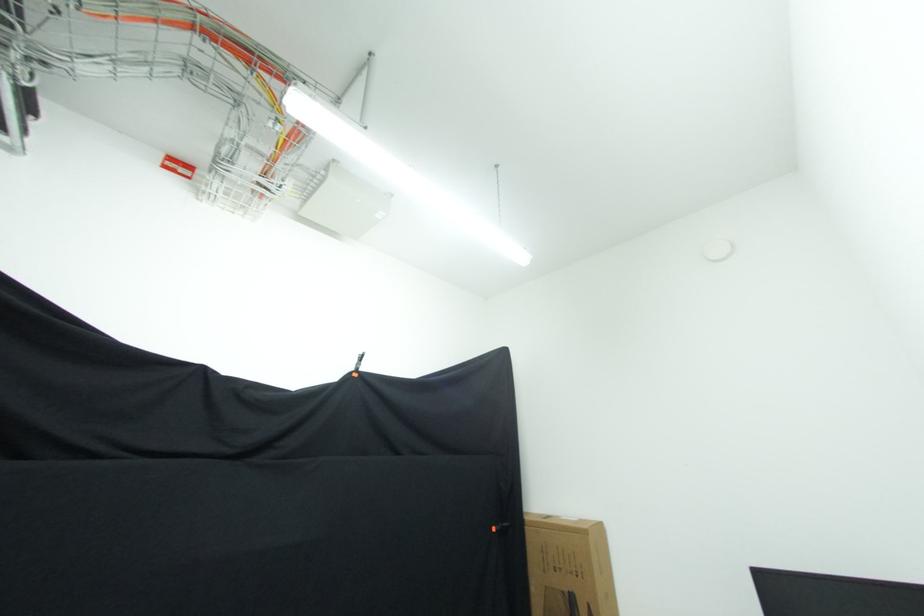
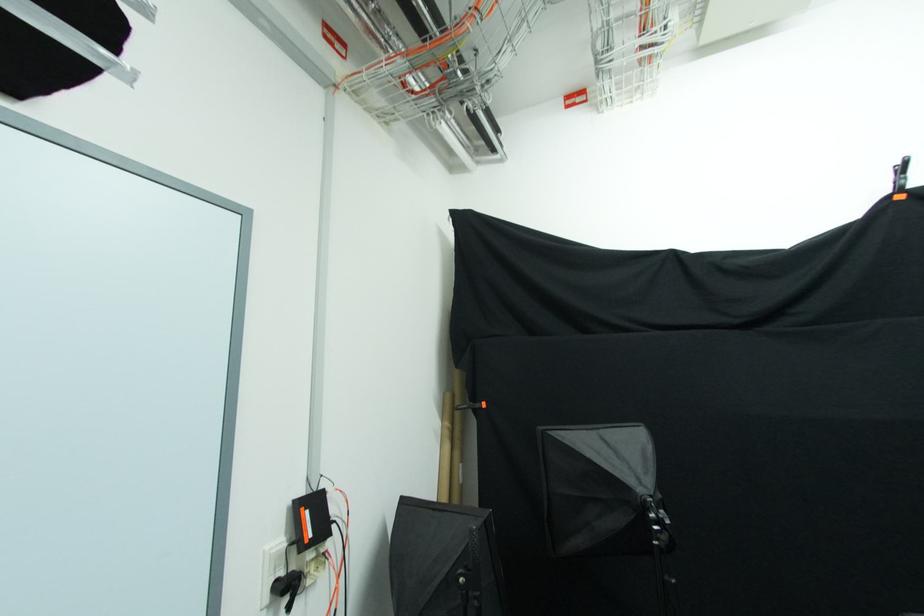
Question: How did the camera likely rotate?

Choices:
 (A) Left
 (B) Right
 (C) Up
 (D) Down

Answer: (A)